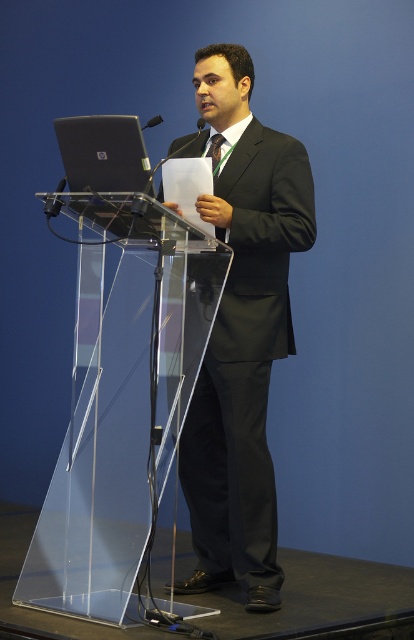
Can you confirm if black glossy suit at center is positioned below silver metallic laptop at upper left?

Indeed, black glossy suit at center is positioned under silver metallic laptop at upper left.

Describe the element at coordinates (242, 333) in the screenshot. The height and width of the screenshot is (640, 414). I see `black glossy suit at center` at that location.

This screenshot has height=640, width=414. In order to click on black glossy suit at center in this screenshot , I will do `click(242, 333)`.

Does black glossy suit at center appear under green silk tie at center?

Yes, black glossy suit at center is below green silk tie at center.

What do you see at coordinates (242, 333) in the screenshot?
I see `black glossy suit at center` at bounding box center [242, 333].

Where is `black glossy suit at center`? Image resolution: width=414 pixels, height=640 pixels. black glossy suit at center is located at coordinates (242, 333).

Does silver metallic laptop at upper left appear on the right side of green silk tie at center?

No, silver metallic laptop at upper left is not to the right of green silk tie at center.

Who is shorter, silver metallic laptop at upper left or green silk tie at center?

Standing shorter between the two is green silk tie at center.

Does point (134, 116) come behind point (219, 164)?

No, (134, 116) is in front of (219, 164).

Identify the location of silver metallic laptop at upper left. (103, 154).